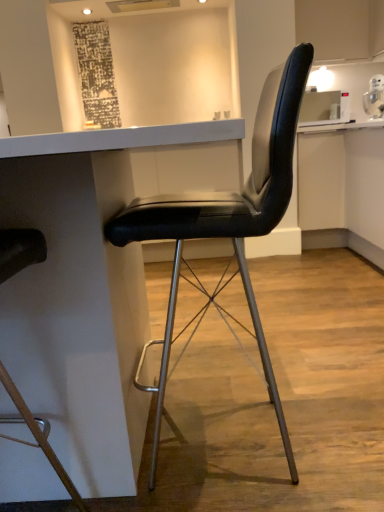
Question: From a real-world perspective, relative to black leather chair at center, which is the 2th chair in right-to-left order, is black leather chair at center, the 1th chair when ordered from right to left, vertically above or below?

Choices:
 (A) below
 (B) above

Answer: (A)

Question: Relative to black leather chair at center, the first chair positioned from the left, is black leather chair at center, the 2th chair positioned from the left, in front or behind?

Choices:
 (A) front
 (B) behind

Answer: (B)

Question: Which is nearer to the black leather chair at center, the 2th chair positioned from the left?

Choices:
 (A) black leather chair at center, which is the 2th chair in right-to-left order
 (B) white glossy table at center

Answer: (B)

Question: Based on their relative distances, which object is farther from the black leather chair at center, the 1th chair when ordered from right to left?

Choices:
 (A) black leather chair at center, the first chair positioned from the left
 (B) white glossy table at center

Answer: (A)